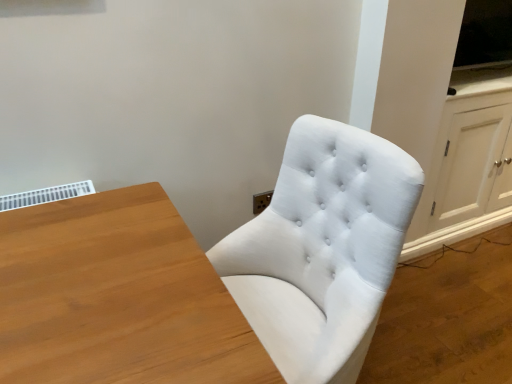
What do you see at coordinates (445, 123) in the screenshot? I see `white wood dresser at right` at bounding box center [445, 123].

Measure the distance between point (x=436, y=169) and camera.

The distance of point (x=436, y=169) from camera is 2.01 meters.

In order to face white wood dresser at right, should I rotate leftwards or rightwards?

It's best to rotate right around 26.730 degrees.

I want to click on white wood dresser at right, so click(445, 123).

Locate an element on the screen. This screenshot has width=512, height=384. white fabric chair at center is located at coordinates (322, 249).

In order to face white fabric chair at center, should I rotate leftwards or rightwards?

You should rotate right by 1.844 degrees.

What is the approximate width of white fabric chair at center?

The width of white fabric chair at center is 23.52 inches.

Measure the distance between point (394, 210) and camera.

Point (394, 210) is 36.65 inches away from camera.

Describe the element at coordinates (322, 249) in the screenshot. I see `white fabric chair at center` at that location.

This screenshot has height=384, width=512. Identify the location of white wood dresser at right. (445, 123).

Which is more to the right, white wood dresser at right or white fabric chair at center?

white wood dresser at right.

Which object is further away from the camera taking this photo, white wood dresser at right or white fabric chair at center?

white wood dresser at right.

Which point is more forward, (504,132) or (311,272)?

Positioned in front is point (311,272).

From the image's perspective, is white wood dresser at right located above white fabric chair at center?

Yes, from the image's perspective, white wood dresser at right is over white fabric chair at center.

From a real-world perspective, is white wood dresser at right beneath white fabric chair at center?

Indeed, from a real-world perspective, white wood dresser at right is positioned beneath white fabric chair at center.

Considering the relative sizes of white wood dresser at right and white fabric chair at center in the image provided, is white wood dresser at right wider than white fabric chair at center?

No.

Is white wood dresser at right taller than white fabric chair at center?

Incorrect, the height of white wood dresser at right is not larger of that of white fabric chair at center.

Considering the relative sizes of white wood dresser at right and white fabric chair at center in the image provided, is white wood dresser at right bigger than white fabric chair at center?

Correct, white wood dresser at right is larger in size than white fabric chair at center.

Could white fabric chair at center be considered to be inside white wood dresser at right?

→ No, white fabric chair at center is not a part of white wood dresser at right.

Is white wood dresser at right positioned far away from white fabric chair at center?

They are positioned close to each other.

Does white wood dresser at right turn towards white fabric chair at center?

No, white wood dresser at right is not facing towards white fabric chair at center.

How different are the orientations of white wood dresser at right and white fabric chair at center in degrees?

The angle between the facing direction of white wood dresser at right and the facing direction of white fabric chair at center is 87.7 degrees.

Image resolution: width=512 pixels, height=384 pixels. I want to click on dresser located underneath the white fabric chair at center (from a real-world perspective), so (x=445, y=123).

Visually, is white fabric chair at center positioned to the left or to the right of white wood dresser at right?

Clearly, white fabric chair at center is on the left of white wood dresser at right in the image.

Which object is closer to the camera taking this photo, white fabric chair at center or white wood dresser at right?

white fabric chair at center.

Is point (347, 261) more distant than point (453, 67)?

No, it is in front of (453, 67).

From the image's perspective, which one is positioned higher, white fabric chair at center or white wood dresser at right?

From the image's view, white wood dresser at right is above.

From a real-world perspective, who is located higher, white fabric chair at center or white wood dresser at right?

white fabric chair at center is physically above.

Is white fabric chair at center thinner than white wood dresser at right?

Incorrect, the width of white fabric chair at center is not less than that of white wood dresser at right.

Which of these two, white fabric chair at center or white wood dresser at right, stands shorter?

Standing shorter between the two is white wood dresser at right.

Who is smaller, white fabric chair at center or white wood dresser at right?

white fabric chair at center.

Is white fabric chair at center positioned beyond the bounds of white wood dresser at right?

Yes, white fabric chair at center is outside of white wood dresser at right.

Would you say white fabric chair at center is a long distance from white wood dresser at right?

They are positioned close to each other.

Is white fabric chair at center positioned with its back to white wood dresser at right?

Yes, white fabric chair at center's orientation is away from white wood dresser at right.

This screenshot has width=512, height=384. What are the coordinates of `dresser directly beneath the white fabric chair at center (from a real-world perspective)` in the screenshot? It's located at (445, 123).

Locate an element on the screen. dresser that appears on the right of white fabric chair at center is located at coordinates (445, 123).

Identify the location of dresser that is above the white fabric chair at center (from the image's perspective). (445, 123).